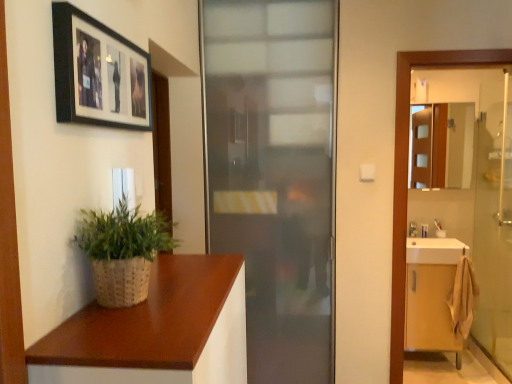
Question: From the image's perspective, is frosted glass door at center below transparent glass elevator at right?

Choices:
 (A) yes
 (B) no

Answer: (B)

Question: Considering the relative sizes of frosted glass door at center and transparent glass elevator at right in the image provided, is frosted glass door at center thinner than transparent glass elevator at right?

Choices:
 (A) yes
 (B) no

Answer: (A)

Question: Does frosted glass door at center have a larger size compared to transparent glass elevator at right?

Choices:
 (A) no
 (B) yes

Answer: (B)

Question: Is the position of frosted glass door at center less distant than that of transparent glass elevator at right?

Choices:
 (A) yes
 (B) no

Answer: (B)

Question: Is frosted glass door at center far from transparent glass elevator at right?

Choices:
 (A) no
 (B) yes

Answer: (A)

Question: Based on their sizes in the image, would you say white glossy sink at right is bigger or smaller than light wood cabinet at right?

Choices:
 (A) big
 (B) small

Answer: (B)

Question: Does point (457, 253) appear closer or farther from the camera than point (413, 337)?

Choices:
 (A) closer
 (B) farther

Answer: (A)

Question: Considering the positions of white glossy sink at right and light wood cabinet at right in the image, is white glossy sink at right taller or shorter than light wood cabinet at right?

Choices:
 (A) tall
 (B) short

Answer: (B)

Question: Which is correct: white glossy sink at right is inside light wood cabinet at right, or outside of it?

Choices:
 (A) outside
 (B) inside

Answer: (A)

Question: Is black matte picture frame at upper left wider or thinner than frosted glass door at center?

Choices:
 (A) wide
 (B) thin

Answer: (B)

Question: Is point (53, 36) closer or farther from the camera than point (211, 21)?

Choices:
 (A) farther
 (B) closer

Answer: (B)

Question: In terms of height, does black matte picture frame at upper left look taller or shorter compared to frosted glass door at center?

Choices:
 (A) short
 (B) tall

Answer: (A)

Question: Relative to frosted glass door at center, is black matte picture frame at upper left in front or behind?

Choices:
 (A) front
 (B) behind

Answer: (A)

Question: Is woven natural plant at lower left taller or shorter than clear glass screen door at right?

Choices:
 (A) tall
 (B) short

Answer: (B)

Question: In terms of width, does woven natural plant at lower left look wider or thinner when compared to clear glass screen door at right?

Choices:
 (A) thin
 (B) wide

Answer: (B)